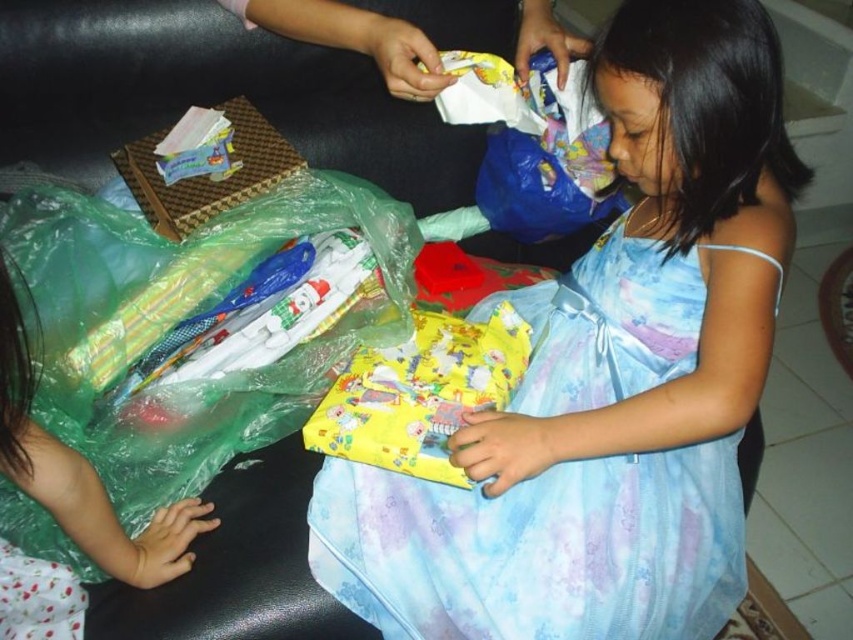
Question: Which point is closer to the camera?

Choices:
 (A) light blue satin dress at center
 (B) yellow paper gift at center
 (C) translucent green plastic bag at lower left

Answer: (C)

Question: Which of the following is the farthest from the observer?

Choices:
 (A) [x=381, y=404]
 (B) [x=152, y=202]
 (C) [x=714, y=500]

Answer: (B)

Question: Is translucent green plastic bag at lower left in front of yellow paper gift at center?

Choices:
 (A) no
 (B) yes

Answer: (B)

Question: Which point appears farthest from the camera in this image?

Choices:
 (A) (259, 120)
 (B) (433, 570)
 (C) (416, 474)
 (D) (67, 492)

Answer: (A)

Question: Is light blue satin dress at center behind yellow paper gift at center?

Choices:
 (A) yes
 (B) no

Answer: (B)

Question: From the image, what is the correct spatial relationship of translucent green plastic bag at lower left in relation to matte plastic package at upper left?

Choices:
 (A) above
 (B) below

Answer: (B)